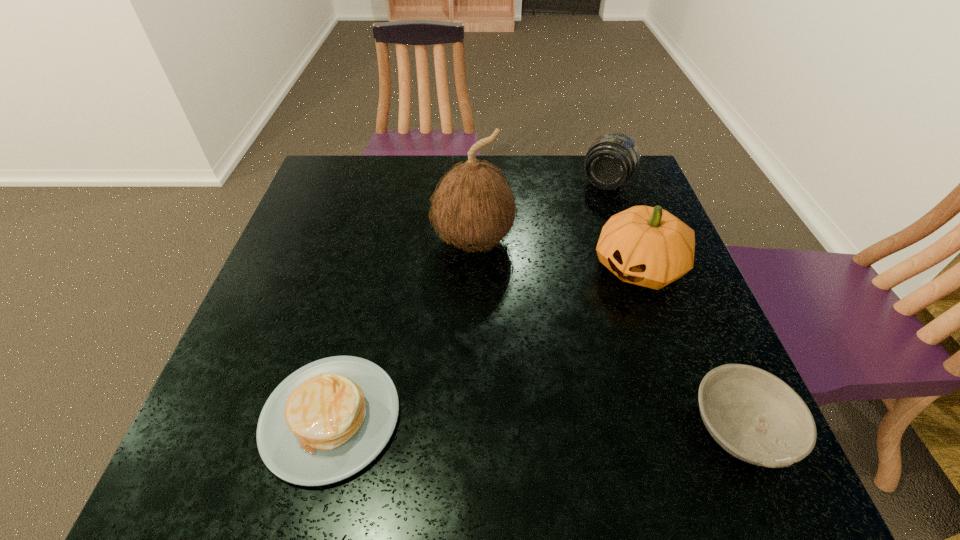
I want to click on bowl located at the near edge, so click(756, 417).

In order to click on object that is at the left edge in this screenshot , I will do 328,420.

Identify the location of bowl that is at the right edge. This screenshot has height=540, width=960. (756, 417).

Find the location of a particular element. This screenshot has width=960, height=540. telephoto lens that is at the right edge is located at coordinates (612, 159).

This screenshot has height=540, width=960. I want to click on gourd positioned at the right edge, so click(x=648, y=246).

The width and height of the screenshot is (960, 540). I want to click on object located in the near left corner section of the desktop, so click(x=328, y=420).

At what (x,y) coordinates should I click in order to perform the action: click on object present at the far right corner. Please return your answer as a coordinate pair (x, y). Looking at the image, I should click on (612, 159).

Where is `object that is positioned at the near right corner`? object that is positioned at the near right corner is located at coordinates (756, 417).

Image resolution: width=960 pixels, height=540 pixels. I want to click on free space at the far edge of the desktop, so click(543, 160).

In the image, there is a desktop. At what (x,y) coordinates should I click in order to perform the action: click on vacant space at the near edge. Please return your answer as a coordinate pair (x, y). The image size is (960, 540). Looking at the image, I should click on click(514, 423).